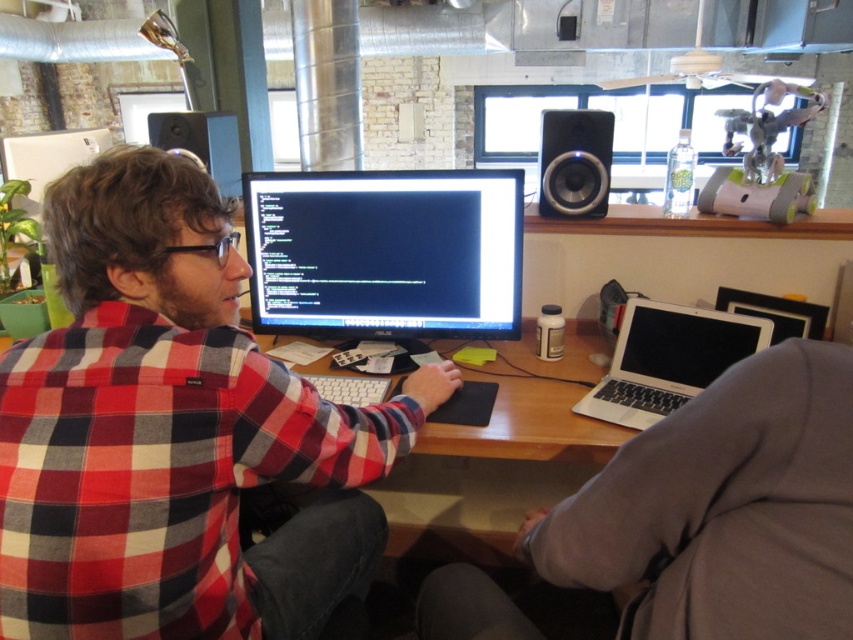
Question: Estimate the real-world distances between objects in this image. Which object is farther from the gray fabric jacket at lower right?

Choices:
 (A) black glossy monitor at center
 (B) matte black speaker at upper left
 (C) red plaid shirt at center

Answer: (B)

Question: Is the position of gray fabric jacket at lower right less distant than that of black glossy monitor at center?

Choices:
 (A) no
 (B) yes

Answer: (B)

Question: Which object appears farthest from the camera in this image?

Choices:
 (A) red plaid shirt at center
 (B) black matte speaker at upper right
 (C) matte black speaker at upper left

Answer: (C)

Question: From the image, what is the correct spatial relationship of gray fabric jacket at lower right in relation to matte black speaker at upper left?

Choices:
 (A) above
 (B) below

Answer: (B)

Question: Among these points, which one is nearest to the camera?

Choices:
 (A) (343, 300)
 (B) (167, 132)
 (C) (212, 435)

Answer: (C)

Question: Can you confirm if gray fabric jacket at lower right is smaller than matte black speaker at upper left?

Choices:
 (A) no
 (B) yes

Answer: (A)